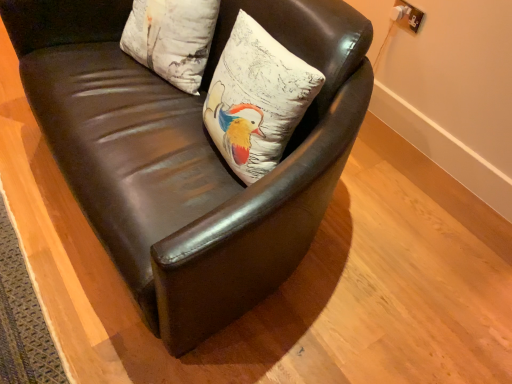
Question: Considering the positions of white matte pillow at center, the 1th pillow viewed from the right, and white textured pillow at upper center, marked as the 2th pillow in a right-to-left arrangement, in the image, is white matte pillow at center, the 1th pillow viewed from the right, taller or shorter than white textured pillow at upper center, marked as the 2th pillow in a right-to-left arrangement,?

Choices:
 (A) short
 (B) tall

Answer: (B)

Question: From a real-world perspective, is white matte pillow at center, which is the 2th pillow in left-to-right order, physically located above or below white textured pillow at upper center, placed as the first pillow when sorted from left to right?

Choices:
 (A) below
 (B) above

Answer: (B)

Question: Which is nearer to the white matte pillow at center, which is the 2th pillow in left-to-right order?

Choices:
 (A) brown leather chair at center
 (B) white textured pillow at upper center, marked as the 2th pillow in a right-to-left arrangement

Answer: (A)

Question: Which is nearer to the white textured pillow at upper center, placed as the first pillow when sorted from left to right?

Choices:
 (A) brown leather chair at center
 (B) white matte pillow at center, which is the 2th pillow in left-to-right order

Answer: (A)